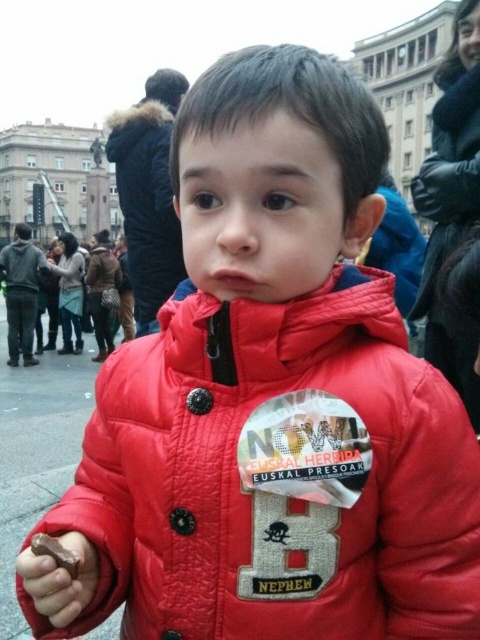
Question: Can you confirm if black leather jacket at upper right is positioned to the right of matte black jacket at upper center?

Choices:
 (A) no
 (B) yes

Answer: (B)

Question: Does black leather jacket at upper right appear over matte black jacket at upper center?

Choices:
 (A) no
 (B) yes

Answer: (B)

Question: Which point is closer to the camera?

Choices:
 (A) matte black jacket at upper center
 (B) leather brown jacket at center
 (C) black leather jacket at upper right
 (D) chocolate matte at lower left

Answer: (D)

Question: Can you confirm if black leather jacket at upper right is positioned to the right of brown matte chocolate at lower left?

Choices:
 (A) no
 (B) yes

Answer: (B)

Question: Which object is closer to the camera taking this photo?

Choices:
 (A) brown matte chocolate at lower left
 (B) chocolate matte at lower left
 (C) matte black jacket at upper center
 (D) black leather jacket at upper right

Answer: (A)

Question: Which object is closer to the camera taking this photo?

Choices:
 (A) black leather jacket at upper right
 (B) chocolate matte at lower left
 (C) brown matte chocolate at lower left
 (D) leather brown jacket at center

Answer: (C)